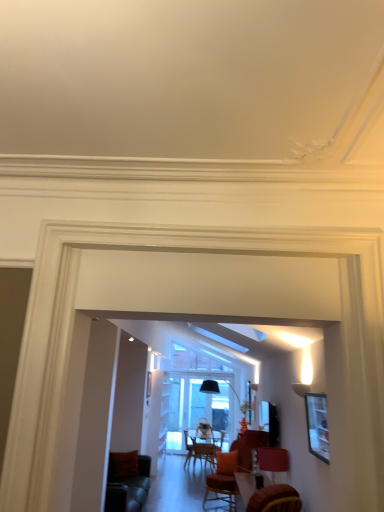
Question: Can you confirm if matte black picture frame at right is smaller than matte red lampshade at lower right?

Choices:
 (A) no
 (B) yes

Answer: (B)

Question: Can matte red lampshade at lower right be found inside matte black picture frame at right?

Choices:
 (A) yes
 (B) no

Answer: (B)

Question: Can we say matte black picture frame at right lies outside matte red lampshade at lower right?

Choices:
 (A) yes
 (B) no

Answer: (A)

Question: Is matte black picture frame at right wider than matte red lampshade at lower right?

Choices:
 (A) yes
 (B) no

Answer: (B)

Question: Considering the relative sizes of matte black picture frame at right and matte red lampshade at lower right in the image provided, is matte black picture frame at right shorter than matte red lampshade at lower right?

Choices:
 (A) no
 (B) yes

Answer: (A)

Question: Is the depth of matte black picture frame at right greater than that of matte red lampshade at lower right?

Choices:
 (A) no
 (B) yes

Answer: (A)

Question: Does matte red lampshade at lower right appear on the right side of matte black picture frame at right?

Choices:
 (A) no
 (B) yes

Answer: (A)

Question: Can you confirm if matte red lampshade at lower right is shorter than matte black picture frame at right?

Choices:
 (A) yes
 (B) no

Answer: (A)

Question: Is matte red lampshade at lower right surrounding matte black picture frame at right?

Choices:
 (A) yes
 (B) no

Answer: (B)

Question: Considering the relative sizes of matte red lampshade at lower right and matte black picture frame at right in the image provided, is matte red lampshade at lower right taller than matte black picture frame at right?

Choices:
 (A) no
 (B) yes

Answer: (A)

Question: From a real-world perspective, is matte red lampshade at lower right located higher than matte black picture frame at right?

Choices:
 (A) yes
 (B) no

Answer: (B)

Question: From the image's perspective, is matte red lampshade at lower right under matte black picture frame at right?

Choices:
 (A) yes
 (B) no

Answer: (A)

Question: Visually, is matte red lampshade at lower right positioned to the left or to the right of matte black picture frame at right?

Choices:
 (A) left
 (B) right

Answer: (A)